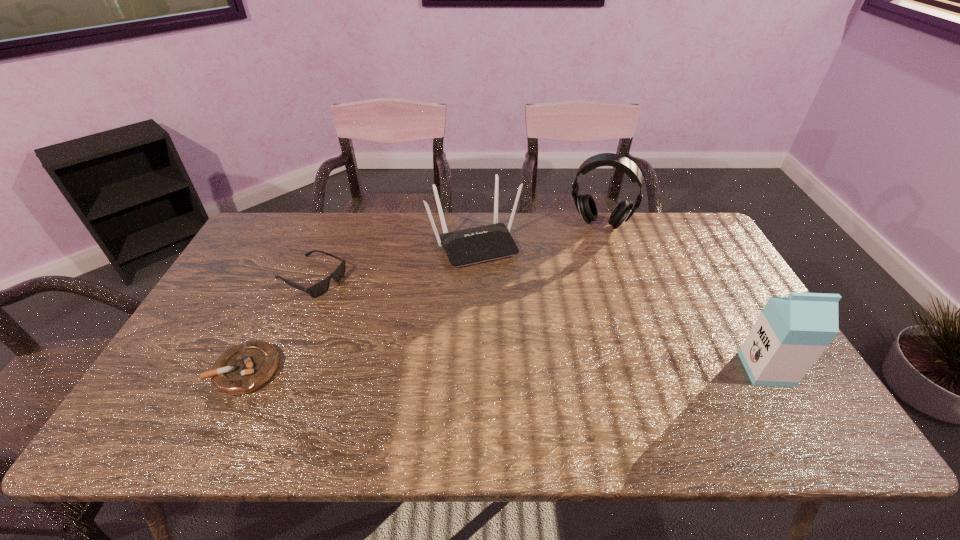
This screenshot has width=960, height=540. What are the coordinates of `free point between the third tallest object and the ashtray` in the screenshot? It's located at (361, 307).

The image size is (960, 540). Find the location of `empty location between the sunglasses and the router`. empty location between the sunglasses and the router is located at coordinates (393, 261).

Where is `free space between the ashtray and the rightmost object`? The width and height of the screenshot is (960, 540). free space between the ashtray and the rightmost object is located at coordinates (506, 369).

At what (x,y) coordinates should I click in order to perform the action: click on object that can be found as the closest to the sunglasses. Please return your answer as a coordinate pair (x, y). The width and height of the screenshot is (960, 540). Looking at the image, I should click on (244, 368).

Find the location of a particular element. Image resolution: width=960 pixels, height=540 pixels. object that can be found as the closest to the ashtray is located at coordinates (316, 290).

I want to click on free space that satisfies the following two spatial constraints: 1. on the back side of the third object from right to left; 2. on the right side of the earphone, so click(475, 225).

Image resolution: width=960 pixels, height=540 pixels. In order to click on free space that satisfies the following two spatial constraints: 1. on the back side of the shortest object; 2. on the left side of the sunglasses in this screenshot , I will do tap(290, 279).

This screenshot has width=960, height=540. Identify the location of free spot that satisfies the following two spatial constraints: 1. on the front side of the milk carton; 2. on the left side of the third object from right to left. (473, 369).